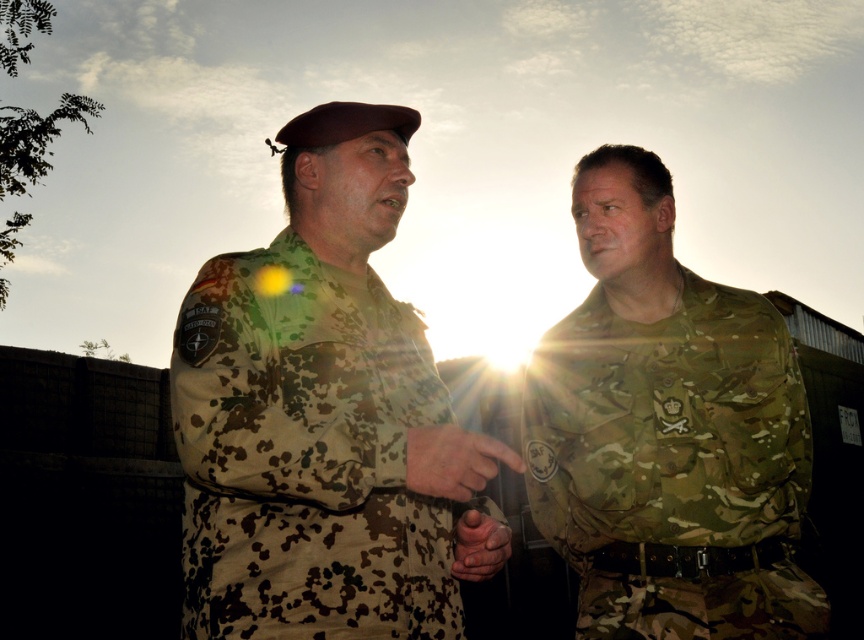
Question: Among these objects, which one is farthest from the camera?

Choices:
 (A) camouflage fabric uniform at right
 (B) camouflage uniform at center

Answer: (A)

Question: Is camouflage uniform at center closer to camera compared to camouflage fabric uniform at right?

Choices:
 (A) yes
 (B) no

Answer: (A)

Question: Is camouflage uniform at center closer to the viewer compared to camouflage fabric uniform at right?

Choices:
 (A) yes
 (B) no

Answer: (A)

Question: Where is camouflage uniform at center located in relation to camouflage fabric uniform at right in the image?

Choices:
 (A) left
 (B) right

Answer: (A)